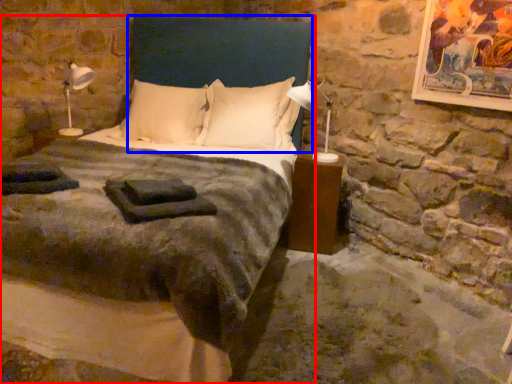
Question: Which object is further to the camera taking this photo, bed (highlighted by a red box) or headboard (highlighted by a blue box)?

Choices:
 (A) bed
 (B) headboard

Answer: (B)